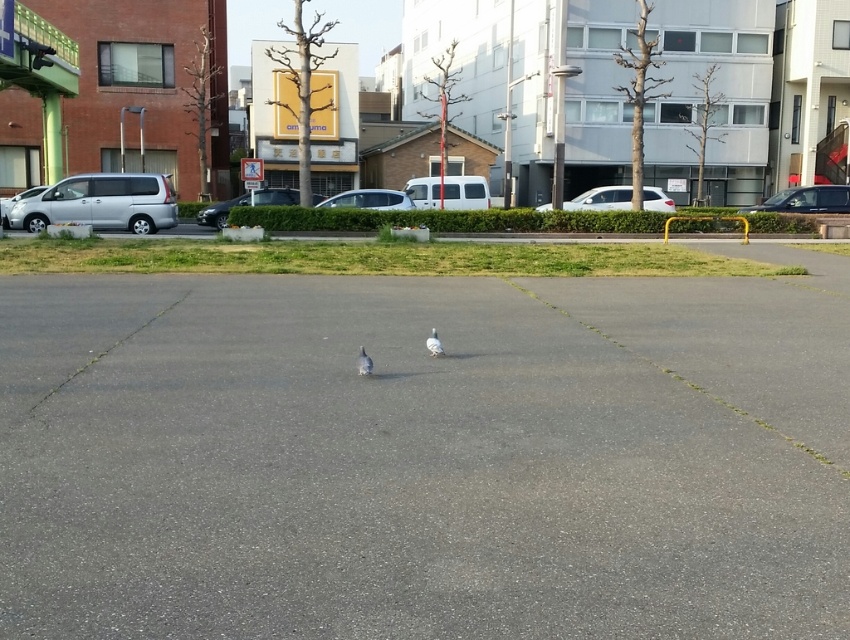
Between silver metallic van at left and white matte bird at center, which one is positioned higher?

silver metallic van at left is higher up.

Does silver metallic van at left come behind white matte bird at center?

Yes, silver metallic van at left is behind white matte bird at center.

This screenshot has width=850, height=640. In order to click on silver metallic van at left in this screenshot , I will do `click(100, 204)`.

Can you confirm if gray asphalt parking lot at center is positioned below white matte pigeon at center?

Correct, gray asphalt parking lot at center is located below white matte pigeon at center.

Can you confirm if gray asphalt parking lot at center is smaller than white matte pigeon at center?

Actually, gray asphalt parking lot at center might be larger than white matte pigeon at center.

Is point (338, 609) positioned in front of point (435, 337)?

Yes.

This screenshot has height=640, width=850. Find the location of `gray asphalt parking lot at center`. gray asphalt parking lot at center is located at coordinates (425, 456).

Can you confirm if dark gray metallic car at right is positioned to the right of white matte bird at center?

Indeed, dark gray metallic car at right is positioned on the right side of white matte bird at center.

Can you confirm if dark gray metallic car at right is positioned to the left of white matte bird at center?

In fact, dark gray metallic car at right is to the right of white matte bird at center.

Does point (805, 196) lie behind point (360, 349)?

Yes, point (805, 196) is farther from viewer.

Find the location of a particular element. This screenshot has width=850, height=640. dark gray metallic car at right is located at coordinates (805, 198).